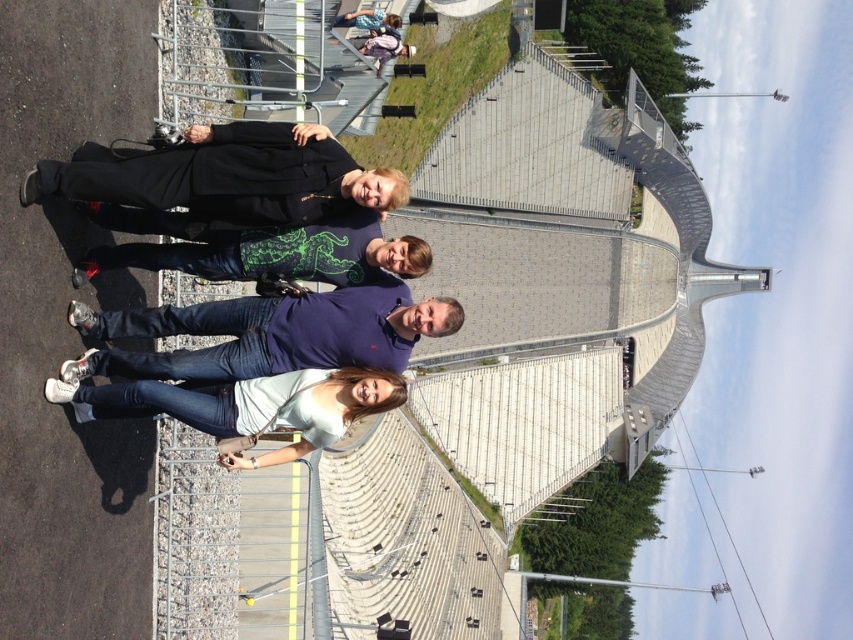
From the picture: You are standing at the center of the image and want to locate the black matte jacket at upper left. Which direction should you look to find it?

The black matte jacket at upper left is located at point (227, 177), so you should look to the upper left direction to find it.

You are a photographer standing at the location where the photo was taken. You want to ensure that the purple cotton polo shirt at center is in focus while keeping the large metallic structure in the background sharp. Based on the distance provided, what is the minimum focal length you should use to achieve this depth of field?

The purple cotton polo shirt at center is 46.68 meters away from the viewer. To keep both the foreground subject and the background structure sharp, a longer focal length like 200mm or higher would be necessary to achieve sufficient depth of field at that distance.

You are a photographer trying to capture a clear shot of the light blue denim jeans at lower center. However, the black matte jacket at upper left is blocking your view. Can you move the jacket to the side to get an unobstructed view?

The black matte jacket at upper left is positioned over light blue denim jeans at lower center, so moving the jacket to the side would allow you to see the light blue denim jeans at lower center without obstruction.